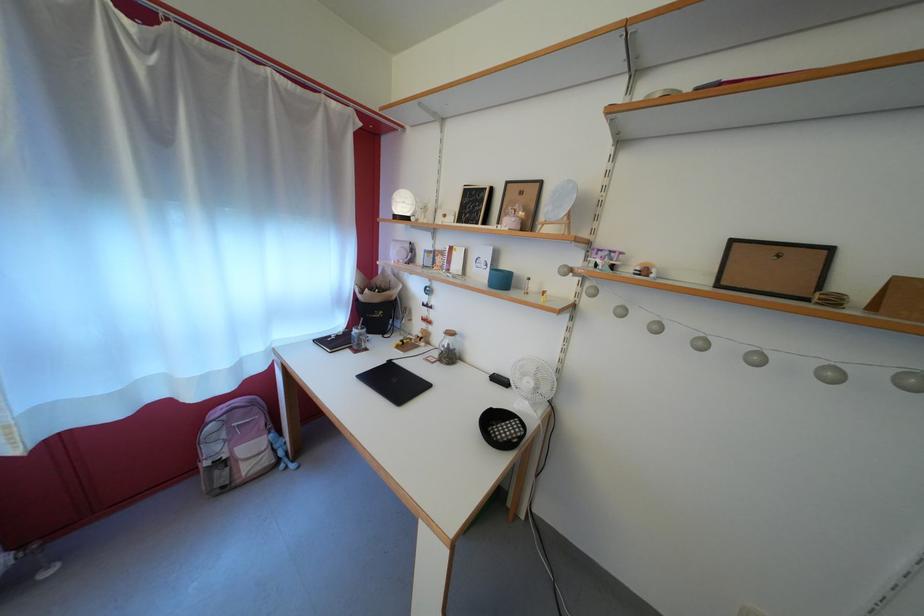
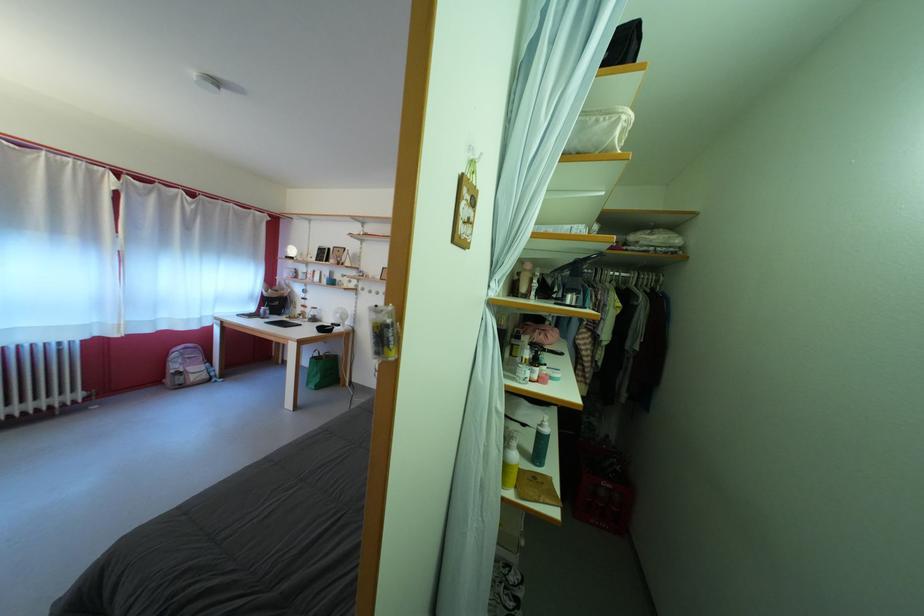
Locate, in the second image, the point that corresponds to (458,363) in the first image.

(322, 325)